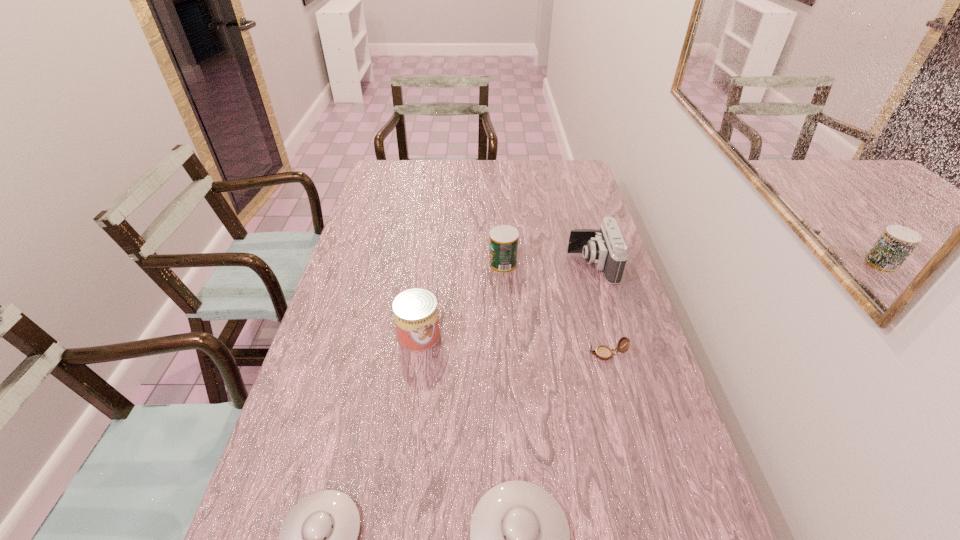
What are the coordinates of `the fifth object from right to left` in the screenshot? It's located at (415, 310).

Locate an element on the screen. The image size is (960, 540). the nearer can is located at coordinates (415, 310).

Identify the location of the farther can. (503, 239).

Locate an element on the screen. The height and width of the screenshot is (540, 960). camera is located at coordinates (606, 248).

The width and height of the screenshot is (960, 540). I want to click on compass, so click(x=603, y=352).

Find the location of a particular element. The image size is (960, 540). free space located on the left of the fifth object from right to left is located at coordinates tap(354, 335).

The height and width of the screenshot is (540, 960). Find the location of `free point located 0.300m on the front of the farther can`. free point located 0.300m on the front of the farther can is located at coordinates (508, 347).

Find the location of a particular element. Image resolution: width=960 pixels, height=540 pixels. free space located 0.390m at the front of the camera with an open lens cover is located at coordinates [x=449, y=265].

Locate an element on the screen. The width and height of the screenshot is (960, 540). vacant space located 0.270m at the front of the camera with an open lens cover is located at coordinates (487, 265).

You are a GUI agent. You are given a task and a screenshot of the screen. Output one action in this format:
    pyautogui.click(x=<x>, y=<y>)
    Task: Click on the free spot located at the front of the camera with an open lens cover
    The height and width of the screenshot is (540, 960).
    Given the screenshot: What is the action you would take?
    pyautogui.click(x=465, y=265)